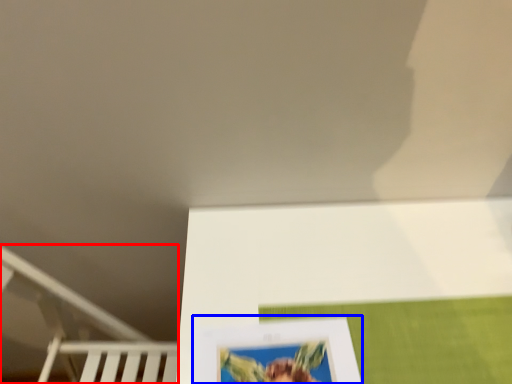
Question: Which of the following is the closest to the observer, bunk bed (highlighted by a red box) or picture frame (highlighted by a blue box)?

Choices:
 (A) bunk bed
 (B) picture frame

Answer: (B)